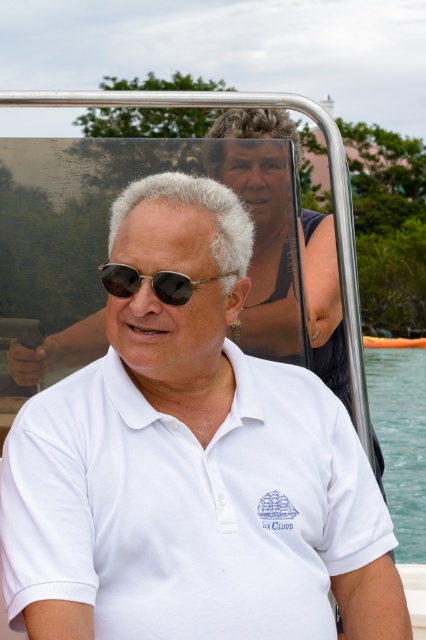
Question: Does white cotton polo shirt at center appear on the right side of shiny black sunglasses at center?

Choices:
 (A) yes
 (B) no

Answer: (A)

Question: Can you confirm if clear water at lower right is positioned to the right of shiny black sunglasses at center?

Choices:
 (A) no
 (B) yes

Answer: (B)

Question: Can you confirm if white cotton polo shirt at center is wider than clear water at lower right?

Choices:
 (A) yes
 (B) no

Answer: (B)

Question: Among these objects, which one is farthest from the camera?

Choices:
 (A) white cotton polo shirt at center
 (B) clear water at lower right
 (C) shiny black sunglasses at center

Answer: (B)

Question: Which point is farther to the camera?

Choices:
 (A) (152, 285)
 (B) (399, 472)
 (C) (46, 579)

Answer: (B)

Question: Which of the following is the farthest from the observer?

Choices:
 (A) clear water at lower right
 (B) shiny black sunglasses at center

Answer: (A)